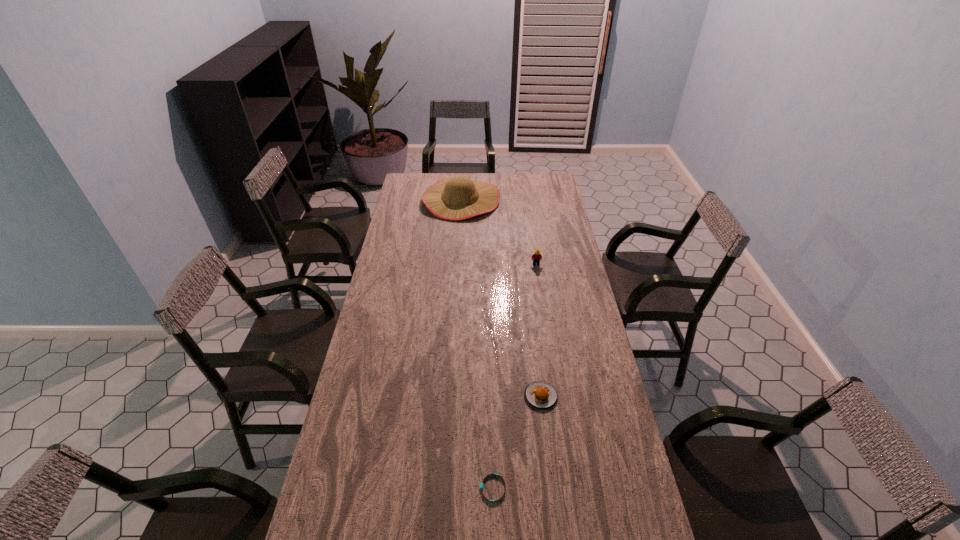
Locate an element on the screen. The image size is (960, 540). the closest object to the second shortest object is located at coordinates (481, 484).

The image size is (960, 540). Find the location of `the third closest object relative to the farthest object`. the third closest object relative to the farthest object is located at coordinates (481, 484).

Where is `vacant space that satisfies the following two spatial constraints: 1. on the front side of the sunhat; 2. on the right side of the second nearest object`? The width and height of the screenshot is (960, 540). vacant space that satisfies the following two spatial constraints: 1. on the front side of the sunhat; 2. on the right side of the second nearest object is located at coordinates (448, 396).

Image resolution: width=960 pixels, height=540 pixels. Find the location of `vacant area that satisfies the following two spatial constraints: 1. on the front-facing side of the Lego; 2. on the buckle of the nearest object`. vacant area that satisfies the following two spatial constraints: 1. on the front-facing side of the Lego; 2. on the buckle of the nearest object is located at coordinates (570, 489).